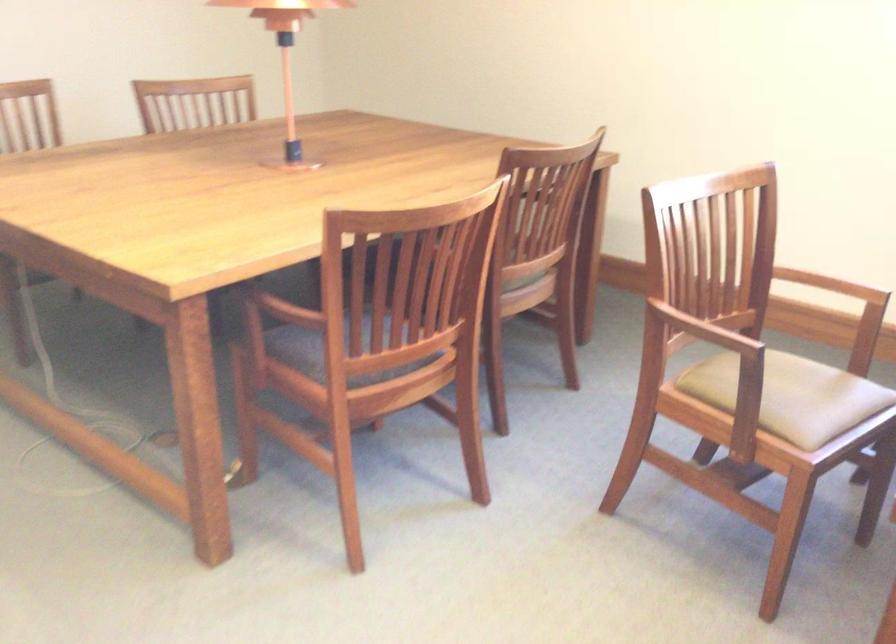
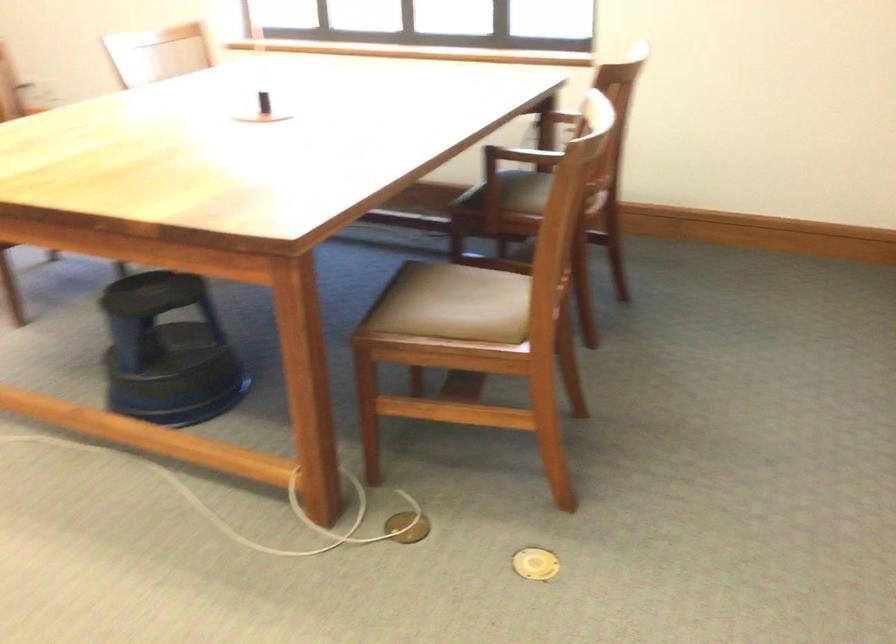
In the scene shown: The images are taken continuously from a first-person perspective. In which direction are you moving?

The cameraman moved toward right, backward.